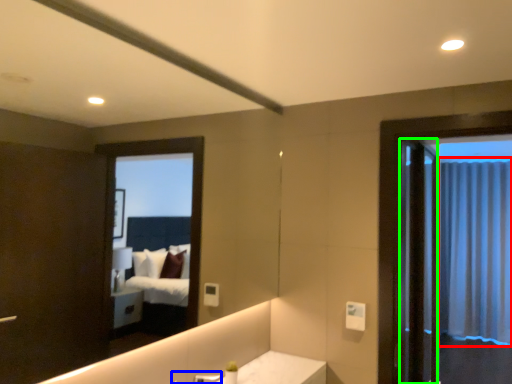
Question: Which object is positioned closest to curtain (highlighted by a red box)? Select from faucet (highlighted by a blue box) and screen door (highlighted by a green box).

Choices:
 (A) faucet
 (B) screen door

Answer: (B)